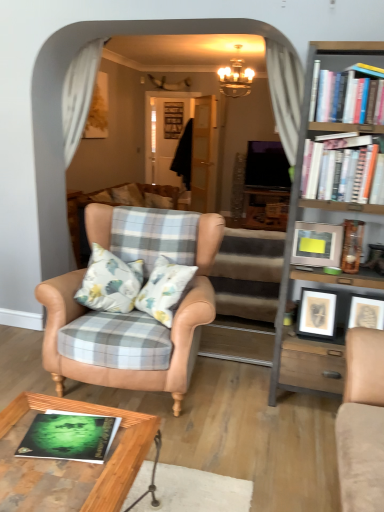
Locate an element on the screen. The height and width of the screenshot is (512, 384). vacant space situated above woodenwoodentable at lower center (from a real-world perspective) is located at coordinates (68, 444).